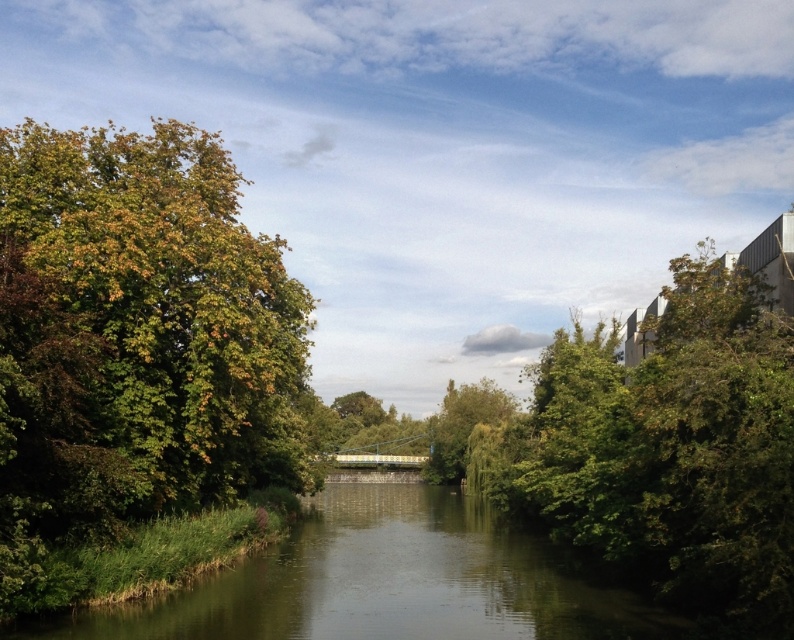
Who is higher up, green smooth water at center or green leafy tree at center?

Positioned higher is green leafy tree at center.

Does green smooth water at center appear on the right side of green leafy tree at center?

No, green smooth water at center is not to the right of green leafy tree at center.

The height and width of the screenshot is (640, 794). What do you see at coordinates (384, 580) in the screenshot? I see `green smooth water at center` at bounding box center [384, 580].

You are a GUI agent. You are given a task and a screenshot of the screen. Output one action in this format:
    pyautogui.click(x=<x>, y=<y>)
    Task: Click on the green smooth water at center
    
    Given the screenshot: What is the action you would take?
    pyautogui.click(x=384, y=580)

Is point (746, 586) closer to viewer compared to point (364, 529)?

That is True.

Which of these two, green leafy tree at right or green smooth water at center, stands shorter?

With less height is green smooth water at center.

What do you see at coordinates (671, 449) in the screenshot? Image resolution: width=794 pixels, height=640 pixels. I see `green leafy tree at right` at bounding box center [671, 449].

At what (x,y) coordinates should I click in order to perform the action: click on green leafy tree at right. Please return your answer as a coordinate pair (x, y). Looking at the image, I should click on (671, 449).

Who is positioned more to the right, green leafy tree at left or green smooth water at center?

green smooth water at center is more to the right.

Is green leafy tree at left taller than green smooth water at center?

Yes.

Image resolution: width=794 pixels, height=640 pixels. I want to click on green leafy tree at left, so click(x=133, y=342).

Identify the location of green leafy tree at left. The height and width of the screenshot is (640, 794). (133, 342).